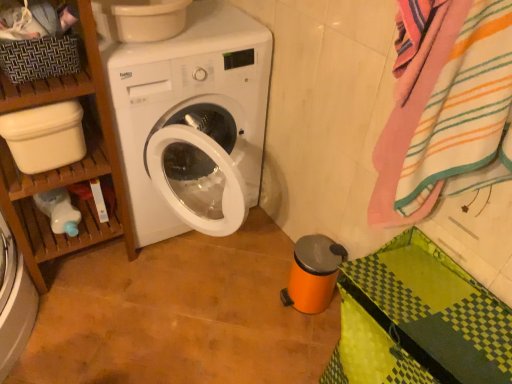
Question: Is wooden shelf at left positioned far away from woven brown basket at upper left?

Choices:
 (A) no
 (B) yes

Answer: (A)

Question: Would you say wooden shelf at left contains woven brown basket at upper left?

Choices:
 (A) no
 (B) yes

Answer: (B)

Question: Does wooden shelf at left have a larger size compared to woven brown basket at upper left?

Choices:
 (A) yes
 (B) no

Answer: (A)

Question: Can you confirm if wooden shelf at left is positioned to the right of woven brown basket at upper left?

Choices:
 (A) yes
 (B) no

Answer: (B)

Question: Is wooden shelf at left closer to the viewer compared to woven brown basket at upper left?

Choices:
 (A) no
 (B) yes

Answer: (B)

Question: Based on their positions, is wooden shelf at left located to the left or right of woven brown basket at upper left?

Choices:
 (A) right
 (B) left

Answer: (B)

Question: From a real-world perspective, is wooden shelf at left positioned above or below woven brown basket at upper left?

Choices:
 (A) below
 (B) above

Answer: (A)

Question: In the image, is wooden shelf at left positioned in front of or behind woven brown basket at upper left?

Choices:
 (A) behind
 (B) front

Answer: (B)

Question: From the image's perspective, is wooden shelf at left above or below woven brown basket at upper left?

Choices:
 (A) below
 (B) above

Answer: (A)

Question: Is striped cotton bath towel at right wider or thinner than wooden shelf at left?

Choices:
 (A) wide
 (B) thin

Answer: (B)

Question: From a real-world perspective, is striped cotton bath towel at right positioned above or below wooden shelf at left?

Choices:
 (A) above
 (B) below

Answer: (A)

Question: Is point (418, 117) positioned closer to the camera than point (84, 18)?

Choices:
 (A) farther
 (B) closer

Answer: (B)

Question: Do you think striped cotton bath towel at right is within wooden shelf at left, or outside of it?

Choices:
 (A) outside
 (B) inside

Answer: (A)

Question: Is point (417, 109) closer or farther from the camera than point (24, 44)?

Choices:
 (A) closer
 (B) farther

Answer: (A)

Question: Based on their sizes in the image, would you say striped cotton bath towel at right is bigger or smaller than woven brown basket at upper left?

Choices:
 (A) big
 (B) small

Answer: (A)